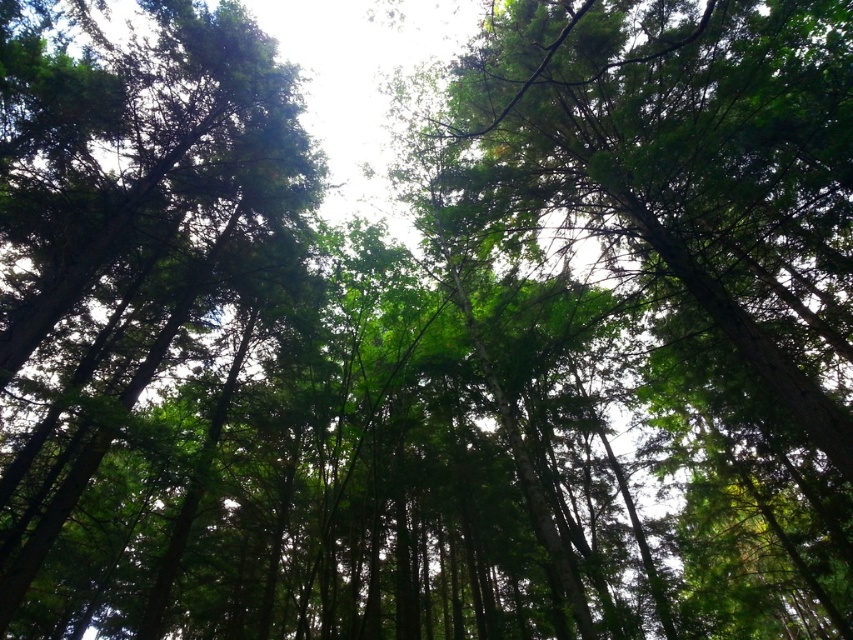
Question: Is green leafy tree at center to the left of green matte tree at upper left from the viewer's perspective?

Choices:
 (A) no
 (B) yes

Answer: (A)

Question: Can you confirm if green leafy tree at center is positioned to the right of green matte tree at upper left?

Choices:
 (A) yes
 (B) no

Answer: (A)

Question: Which of the following is the farthest from the observer?

Choices:
 (A) green matte tree at upper left
 (B) green leafy tree at center

Answer: (A)

Question: Does green leafy tree at center have a smaller size compared to green matte tree at upper left?

Choices:
 (A) no
 (B) yes

Answer: (A)

Question: Which object appears closest to the camera in this image?

Choices:
 (A) green leafy tree at center
 (B) green matte tree at upper left

Answer: (A)

Question: Which point is farther to the camera?

Choices:
 (A) green leafy tree at center
 (B) green matte tree at upper left

Answer: (B)